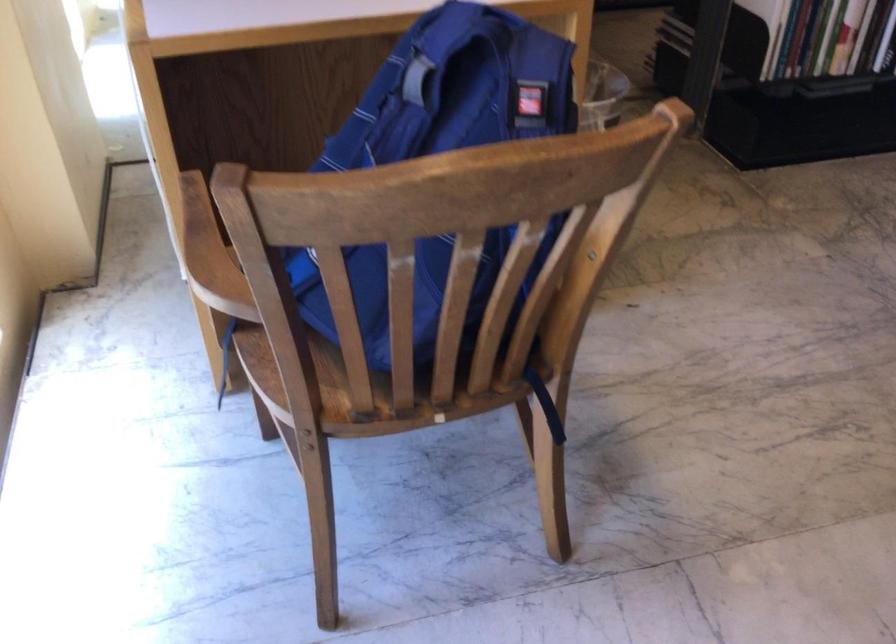
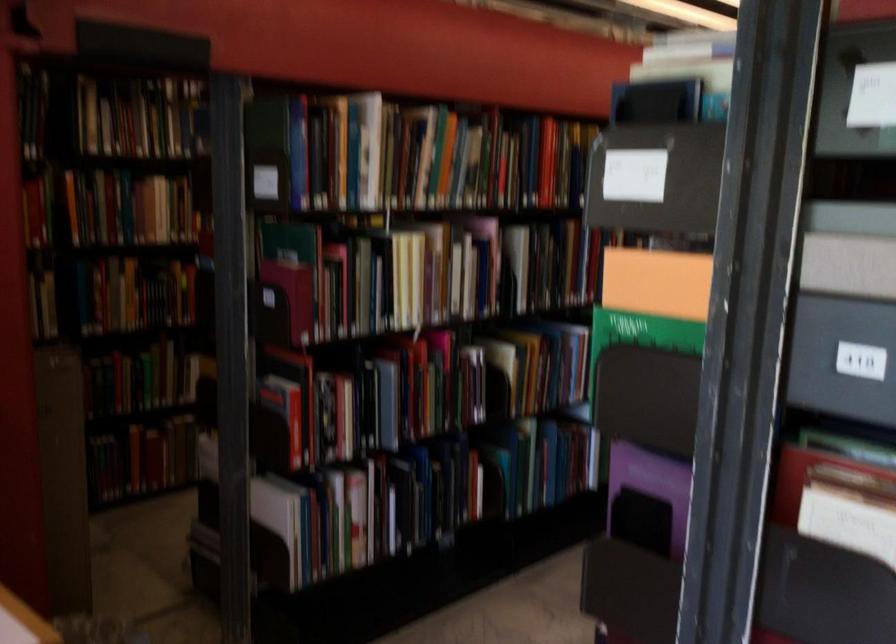
The first image is from the beginning of the video and the second image is from the end. How did the camera likely rotate when shooting the video?

The camera's rotation is toward right-up.